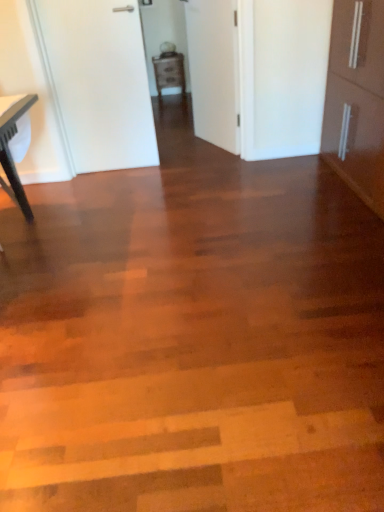
Locate an element on the screen. The image size is (384, 512). vacant area that is situated to the right of matte black table at left is located at coordinates (58, 225).